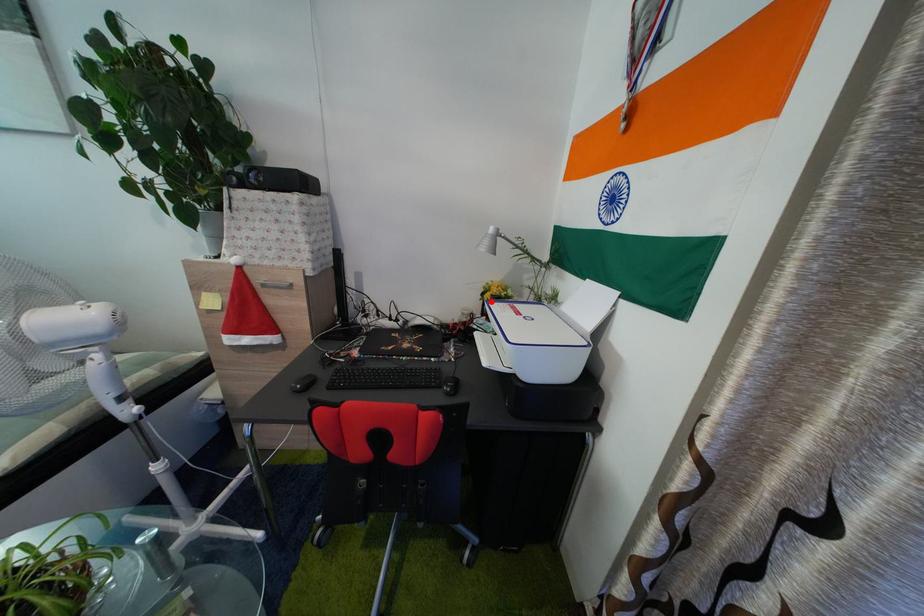
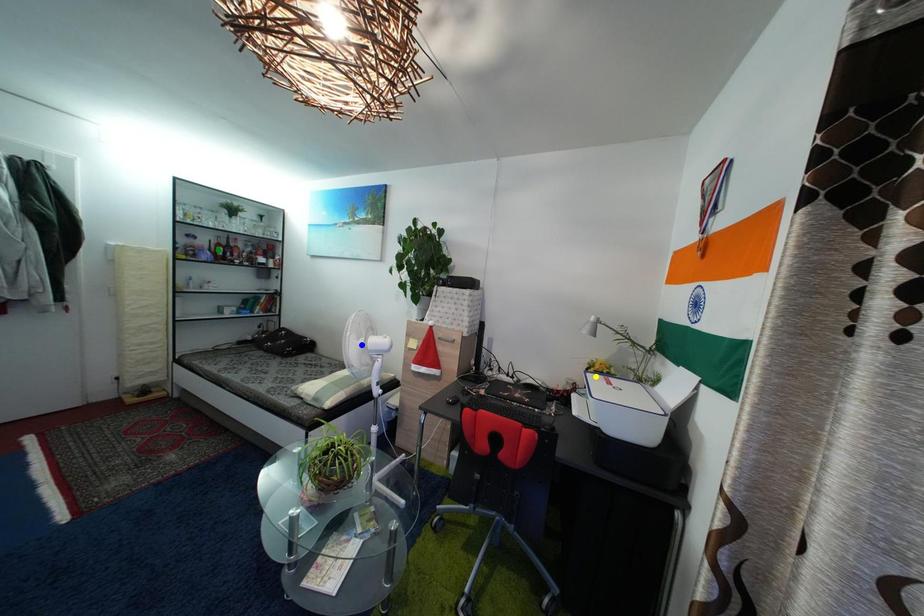
Question: I am providing you with two images of the same scene from different viewpoints. A red point is marked on the first image. You are given multiple points on the second image. In image 2, which mark is for the same physical point as the one in image 1?

Choices:
 (A) green point
 (B) yellow point
 (C) blue point

Answer: (B)